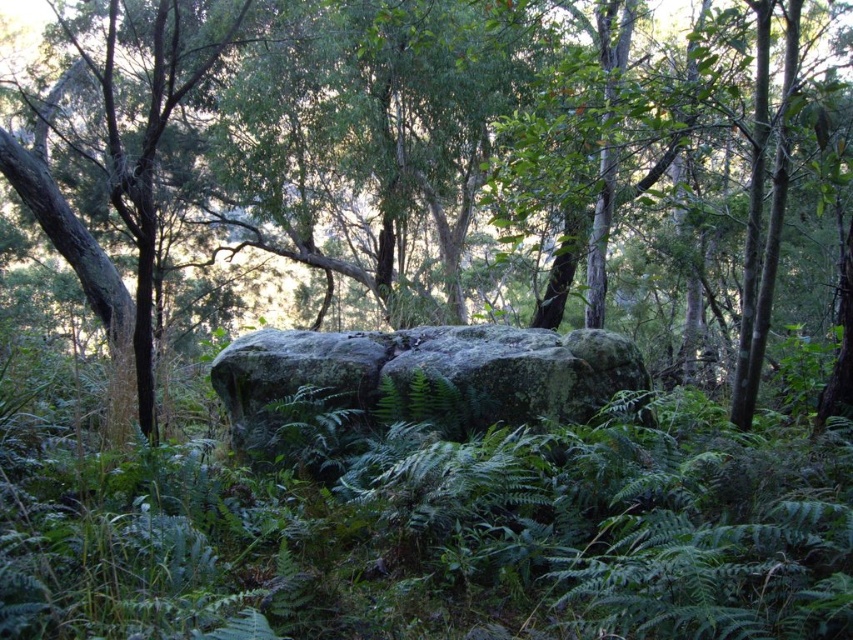
You are a hiker navigating a forest path and see the green mossy rock at center and the green mossy boulder at center. Which one is positioned to the left?

The green mossy rock at center is positioned to the left of the green mossy boulder at center.

Looking at this image, you are a hiker who wants to place a 25 feet long tent between the green mossy rock at center and the green mossy boulder at center. Can you fit the tent there?

The distance between the green mossy rock at center and the green mossy boulder at center is 25.16 feet. Since the tent is 25 feet long, it can fit between them with 0.16 feet of space remaining.